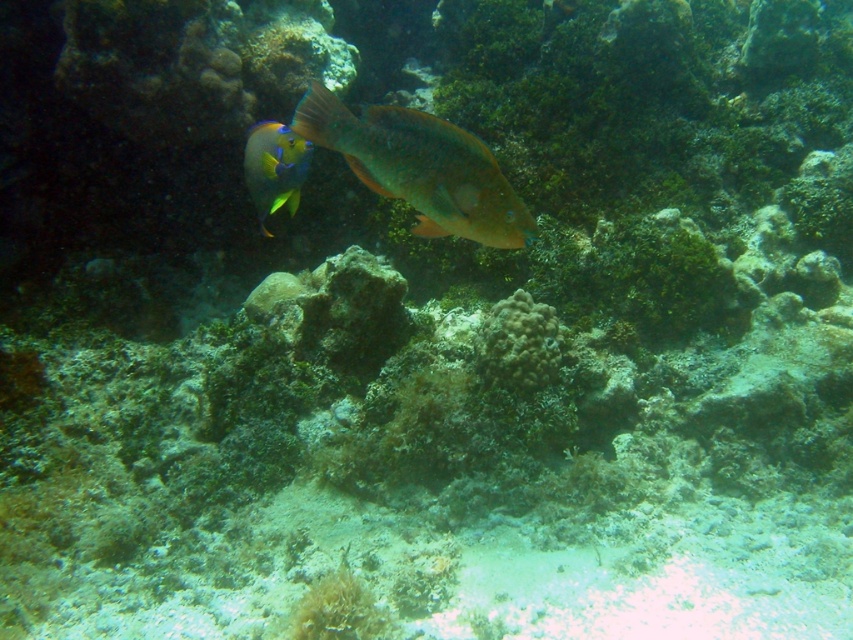
Is shiny orange fish at center to the right of shiny blue fish at center from the viewer's perspective?

Correct, you'll find shiny orange fish at center to the right of shiny blue fish at center.

In the scene shown: Is shiny orange fish at center behind shiny blue fish at center?

No, it is not.

Does point (479, 204) lie behind point (265, 173)?

No, it is not.

Find the location of a particular element. The image size is (853, 640). shiny orange fish at center is located at coordinates (421, 168).

Does rough textured coral at center appear on the left side of shiny blue fish at center?

In fact, rough textured coral at center is to the right of shiny blue fish at center.

Can you confirm if rough textured coral at center is positioned to the right of shiny blue fish at center?

Indeed, rough textured coral at center is positioned on the right side of shiny blue fish at center.

Measure the distance between point (537, 301) and camera.

The distance of point (537, 301) from camera is 1.94 meters.

You are a GUI agent. You are given a task and a screenshot of the screen. Output one action in this format:
    pyautogui.click(x=<x>, y=<y>)
    Task: Click on the rough textured coral at center
    The image size is (853, 640).
    Given the screenshot: What is the action you would take?
    pyautogui.click(x=518, y=342)

Does shiny orange fish at center have a larger size compared to rough textured coral at center?

Correct, shiny orange fish at center is larger in size than rough textured coral at center.

Can you confirm if shiny orange fish at center is smaller than rough textured coral at center?

No, shiny orange fish at center is not smaller than rough textured coral at center.

Is point (363, 115) in front of point (503, 346)?

Yes, it is in front of point (503, 346).

Find the location of `shiny orange fish at center`. shiny orange fish at center is located at coordinates (421, 168).